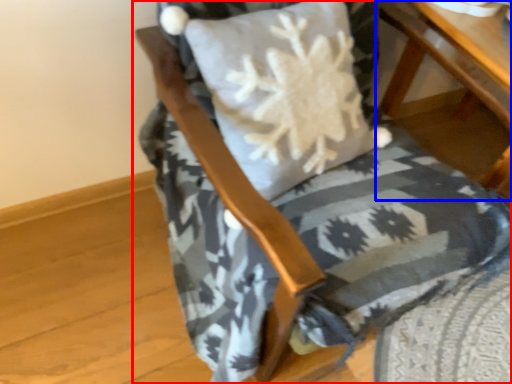
Question: Which point is further to the camera, chair (highlighted by a red box) or table (highlighted by a blue box)?

Choices:
 (A) chair
 (B) table

Answer: (B)